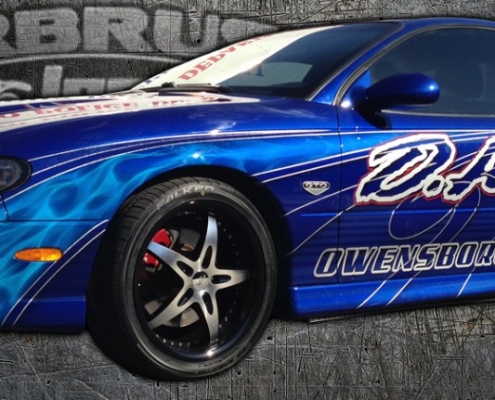
The height and width of the screenshot is (400, 495). Identify the location of floor. (398, 340).